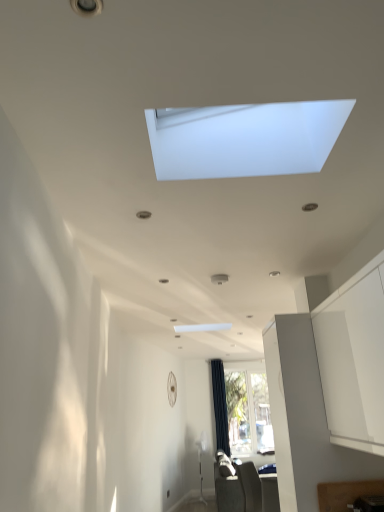
Question: Which direction should I rotate to look at clear glass window at center, acting as the 2th window starting from the left, — up or down?

Choices:
 (A) down
 (B) up

Answer: (A)

Question: Can you confirm if black fabric curtain at center is taller than dark gray fabric sofa at lower center, which is the 1th furniture from bottom to top?

Choices:
 (A) yes
 (B) no

Answer: (A)

Question: Can you confirm if black fabric curtain at center is smaller than dark gray fabric sofa at lower center, arranged as the 2th furniture when viewed from the front?

Choices:
 (A) yes
 (B) no

Answer: (A)

Question: Is black fabric curtain at center at the left side of dark gray fabric sofa at lower center, placed as the second furniture when sorted from top to bottom?

Choices:
 (A) no
 (B) yes

Answer: (B)

Question: Is black fabric curtain at center thinner than dark gray fabric sofa at lower center, placed as the second furniture when sorted from top to bottom?

Choices:
 (A) no
 (B) yes

Answer: (B)

Question: Is black fabric curtain at center to the right of dark gray fabric sofa at lower center, which is the first furniture in back-to-front order, from the viewer's perspective?

Choices:
 (A) yes
 (B) no

Answer: (B)

Question: Can you confirm if black fabric curtain at center is bigger than dark gray fabric sofa at lower center, which is the 1th furniture from bottom to top?

Choices:
 (A) no
 (B) yes

Answer: (A)

Question: Can you confirm if white matte window at upper center, positioned as the second window in right-to-left order, is positioned to the left of dark gray fabric sofa at lower center, placed as the second furniture when sorted from top to bottom?

Choices:
 (A) no
 (B) yes

Answer: (B)

Question: Is white matte window at upper center, arranged as the 1th window when viewed from the front, smaller than dark gray fabric sofa at lower center, which is the 1th furniture from bottom to top?

Choices:
 (A) no
 (B) yes

Answer: (B)

Question: Does white matte window at upper center, the first window from the left, have a greater height compared to dark gray fabric sofa at lower center, arranged as the 2th furniture when viewed from the front?

Choices:
 (A) no
 (B) yes

Answer: (A)

Question: Is white matte window at upper center, arranged as the 1th window when viewed from the front, looking in the opposite direction of dark gray fabric sofa at lower center, placed as the second furniture when sorted from top to bottom?

Choices:
 (A) yes
 (B) no

Answer: (B)

Question: Is white matte window at upper center, which is the second window from bottom to top, not within dark gray fabric sofa at lower center, placed as the second furniture when sorted from top to bottom?

Choices:
 (A) yes
 (B) no

Answer: (A)

Question: Would you say dark gray fabric sofa at lower center, which is the 1th furniture from bottom to top, is part of white matte window at upper center, the first window from the left,'s contents?

Choices:
 (A) no
 (B) yes

Answer: (A)

Question: Is clear glass window at center, acting as the 2th window starting from the left, thinner than dark gray fabric sofa at lower center, which is the 1th furniture from bottom to top?

Choices:
 (A) no
 (B) yes

Answer: (B)